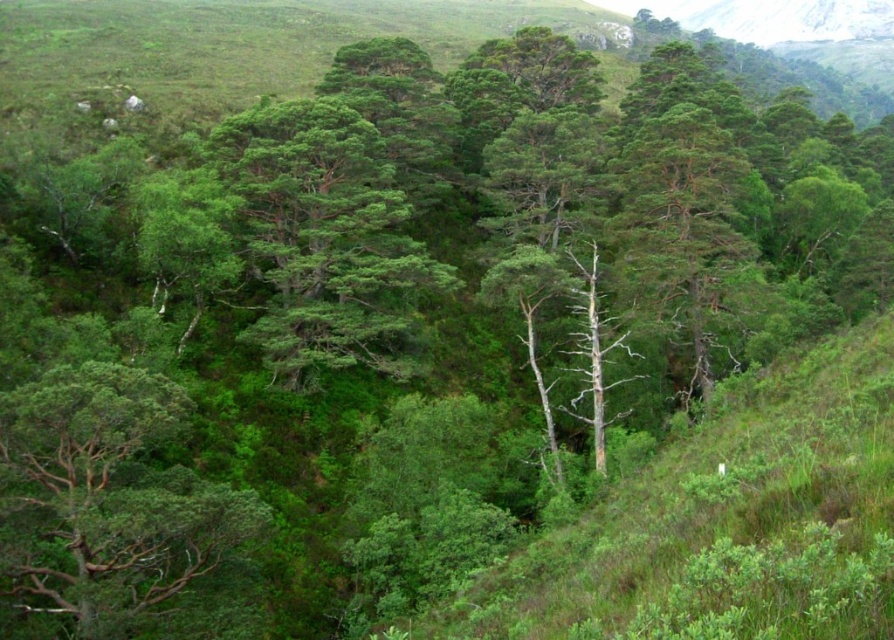
Question: Which object is the farthest from the green needle-like foliage at center?

Choices:
 (A) green rough bark tree at center
 (B) brown rough bark tree at lower left

Answer: (B)

Question: Which point is closer to the camera?

Choices:
 (A) (671, 131)
 (B) (232, 163)

Answer: (B)

Question: Is green needle-like foliage at center below green rough bark tree at center?

Choices:
 (A) yes
 (B) no

Answer: (B)

Question: Is brown rough bark tree at lower left closer to camera compared to green rough bark tree at center?

Choices:
 (A) no
 (B) yes

Answer: (B)

Question: Does green needle-like foliage at center appear under green rough bark tree at center?

Choices:
 (A) no
 (B) yes

Answer: (A)

Question: Which of the following is the closest to the observer?

Choices:
 (A) (690, 134)
 (B) (154, 580)

Answer: (B)